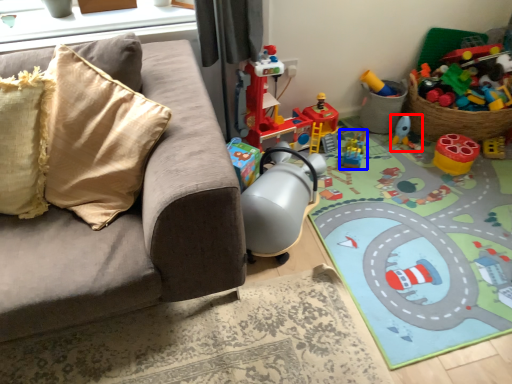
Question: Which of the following is the closest to the observer, toy (highlighted by a red box) or toy (highlighted by a blue box)?

Choices:
 (A) toy
 (B) toy

Answer: (B)